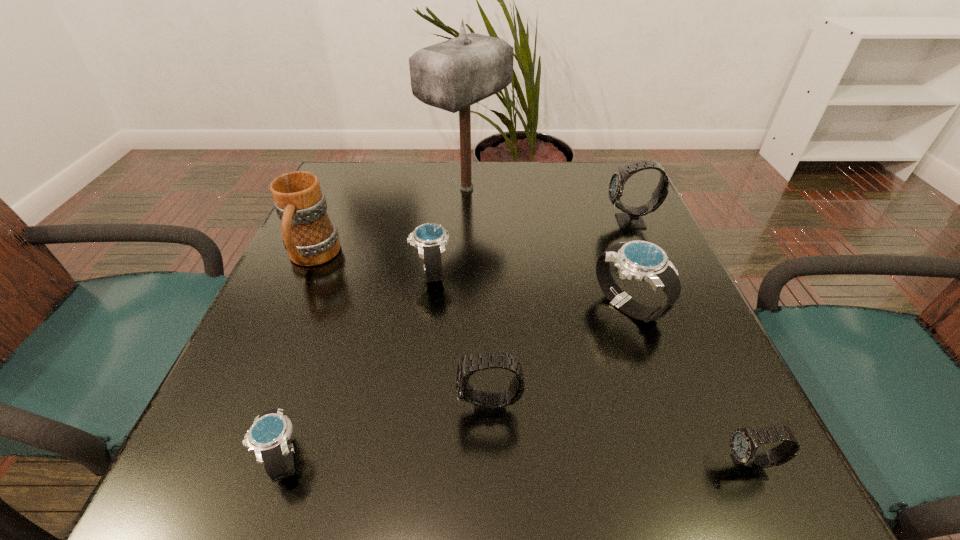
This screenshot has width=960, height=540. I want to click on free space between the mug and the tallest object, so click(389, 223).

You are a GUI agent. You are given a task and a screenshot of the screen. Output one action in this format:
    pyautogui.click(x=<x>, y=<y>)
    Task: Click on the unoccupied position between the mug and the farthest gray watch
    Image resolution: width=960 pixels, height=540 pixels.
    Given the screenshot: What is the action you would take?
    pyautogui.click(x=471, y=240)

Find the location of a particular element. This screenshot has height=540, width=960. empty location between the farthest gray watch and the second biggest silver watch is located at coordinates (531, 247).

Identify the location of unoccupied area between the mallet and the rightmost silver watch. (547, 247).

Where is `vacant area that lies between the nearest silver watch and the second farthest gray watch`? The height and width of the screenshot is (540, 960). vacant area that lies between the nearest silver watch and the second farthest gray watch is located at coordinates (387, 434).

Locate an element on the screen. The width and height of the screenshot is (960, 540). free space between the third nearest watch and the smallest gray watch is located at coordinates (619, 438).

Choose which object is the fourth nearest neighbor to the second silver watch from right to left. Please provide its 2D coordinates. Your answer should be formatted as a tuple, i.e. [(x, y)], where the tuple contains the x and y coordinates of a point satisfying the conditions above.

[(641, 260)]

Where is `object that can be found as the seventh closest to the smallest silver watch`? This screenshot has height=540, width=960. object that can be found as the seventh closest to the smallest silver watch is located at coordinates (632, 218).

Point out which watch is positioned as the third nearest to the rightmost silver watch. Please provide its 2D coordinates. Your answer should be formatted as a tuple, i.e. [(x, y)], where the tuple contains the x and y coordinates of a point satisfying the conditions above.

[(744, 442)]

Choose which watch is the nearest neighbor to the mug. Please provide its 2D coordinates. Your answer should be formatted as a tuple, i.e. [(x, y)], where the tuple contains the x and y coordinates of a point satisfying the conditions above.

[(430, 238)]